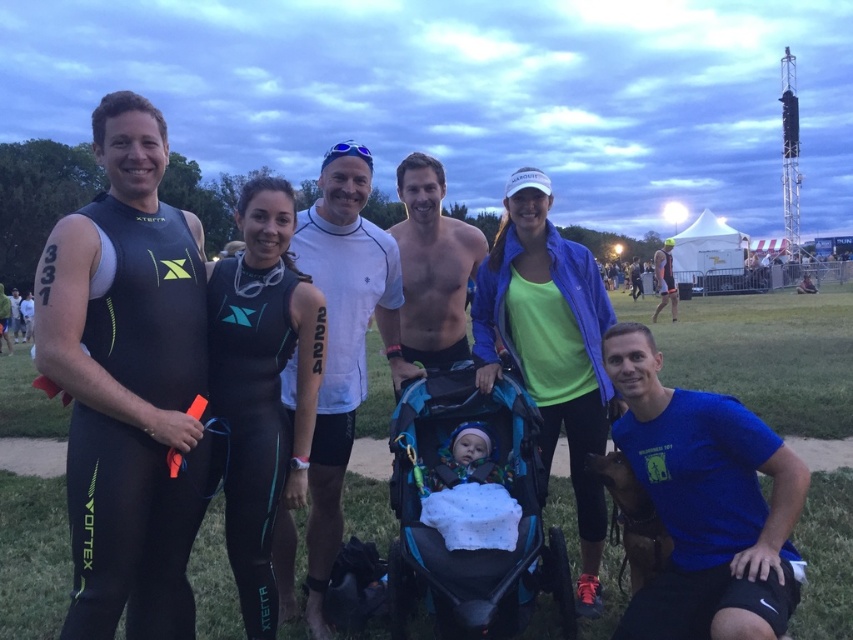
You are a photographer at the event and need to capture a photo of the white matte shirt at center without the teal fabric stroller at center blocking it. How should you adjust your position?

Move your position to the side so that the white matte shirt at center is no longer aligned with the teal fabric stroller at center, as the stroller is positioned under the shirt and could be blocking the view from the current angle.